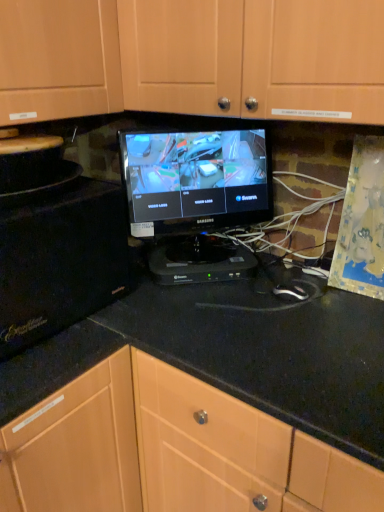
Identify the location of free space above black granite countertop at center (from a real-world perspective). (289, 332).